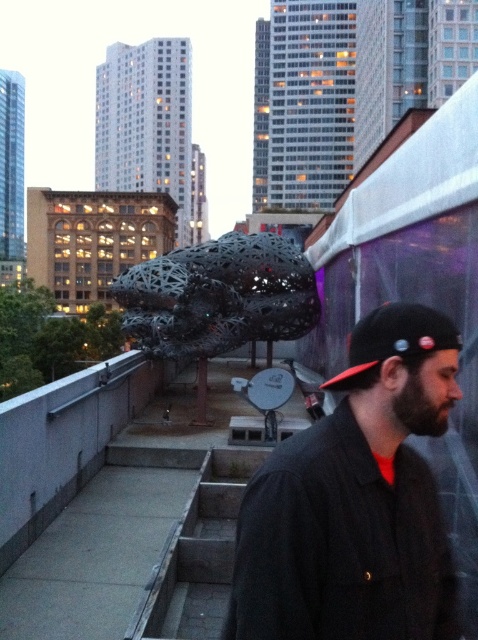
Who is shorter, black matte jacket at right or black fabric baseball cap at right?

black fabric baseball cap at right is shorter.

Does point (412, 305) come closer to viewer compared to point (371, 339)?

No, (412, 305) is behind (371, 339).

Measure the distance between black matte jacket at right and camera.

7.79 feet

Locate an element on the screen. black matte jacket at right is located at coordinates (356, 500).

Consider the image. Can you confirm if black wire mesh sculpture at center is positioned to the right of black fabric baseball cap at right?

No, black wire mesh sculpture at center is not to the right of black fabric baseball cap at right.

The width and height of the screenshot is (478, 640). Describe the element at coordinates (219, 296) in the screenshot. I see `black wire mesh sculpture at center` at that location.

Describe the element at coordinates (219, 296) in the screenshot. The width and height of the screenshot is (478, 640). I see `black wire mesh sculpture at center` at that location.

Locate an element on the screen. black wire mesh sculpture at center is located at coordinates (219, 296).

Is point (332, 520) farther from viewer compared to point (196, 337)?

No.

Does black matte jacket at right have a larger size compared to black wire mesh sculpture at center?

Incorrect, black matte jacket at right is not larger than black wire mesh sculpture at center.

I want to click on black matte jacket at right, so click(356, 500).

The image size is (478, 640). I want to click on black matte jacket at right, so click(356, 500).